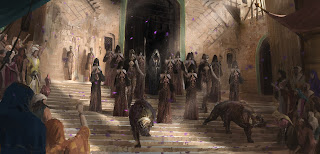
Where is `green trim`? The width and height of the screenshot is (320, 154). green trim is located at coordinates (263, 40), (183, 5).